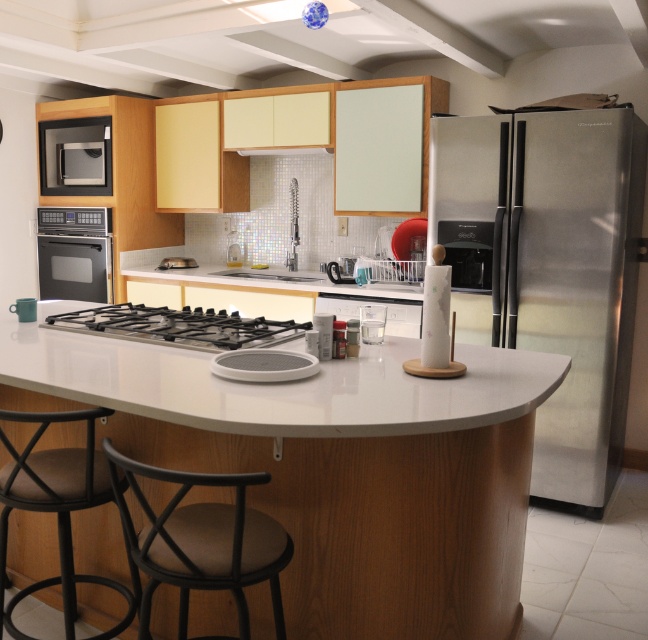
You are a delivery person who needs to place a rectangular box that is 50 centimeters long on the white glossy countertop at center without moving the black metal bar stool at lower left. Is there enough space between them to do this?

The white glossy countertop at center and the black metal bar stool at lower left are 51.33 centimeters apart. Since the box is 50 centimeters long, there is enough space to place it between them without moving the stool.

You are a chef preparing to place a hot dish from the microwave onto the counter. Which appliance should you approach first, the stainless steel refrigerator at right or the satin silver microwave at upper left, and why?

You should approach the satin silver microwave at upper left first because the hot dish is coming from it. The stainless steel refrigerator at right is located below the microwave, but since the dish is in the microwave, you need to access the microwave first to retrieve it.

You are a chef preparing to place a hot dish on the white glossy countertop at center. However, you notice the satin silver microwave at upper left nearby. Based on their positions, could the microwave interfere with placing the dish on the countertop?

The white glossy countertop at center is in front of the satin silver microwave at upper left, meaning the microwave is behind the countertop. Since the microwave is behind the countertop, it won not interfere with placing the dish on the white glossy countertop at center.